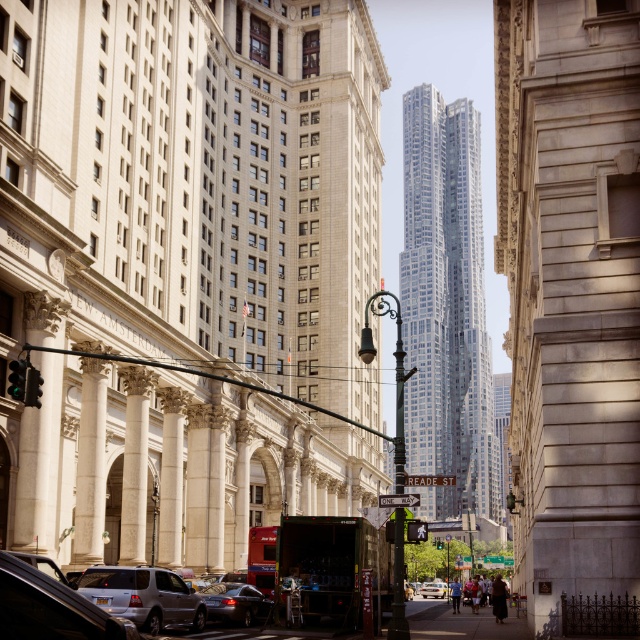
Looking at this image, who is positioned more to the left, silver metallic suv at lower left or white marble pillar at center?

white marble pillar at center

Is silver metallic suv at lower left to the right of white marble pillar at center from the viewer's perspective?

Yes, silver metallic suv at lower left is to the right of white marble pillar at center.

Is point (131, 605) closer to viewer compared to point (131, 368)?

Yes, point (131, 605) is in front of point (131, 368).

Locate an element on the screen. silver metallic suv at lower left is located at coordinates (144, 596).

Is silver metallic sedan at lower left taller than metallic rectangular traffic light at center?

No, silver metallic sedan at lower left is not taller than metallic rectangular traffic light at center.

Does silver metallic sedan at lower left appear under metallic rectangular traffic light at center?

Actually, silver metallic sedan at lower left is above metallic rectangular traffic light at center.

Who is more distant from viewer, (49,604) or (426,522)?

Point (426,522)

This screenshot has width=640, height=640. Find the location of `silver metallic sedan at lower left`. silver metallic sedan at lower left is located at coordinates (49, 609).

Does white marble pillar at center have a larger size compared to metallic red street sign at center?

No, white marble pillar at center is not bigger than metallic red street sign at center.

Is white marble pillar at center below metallic red street sign at center?

No, white marble pillar at center is not below metallic red street sign at center.

The width and height of the screenshot is (640, 640). Identify the location of white marble pillar at center. (134, 465).

Find the location of a particular element. The width and height of the screenshot is (640, 640). white marble pillar at center is located at coordinates (134, 465).